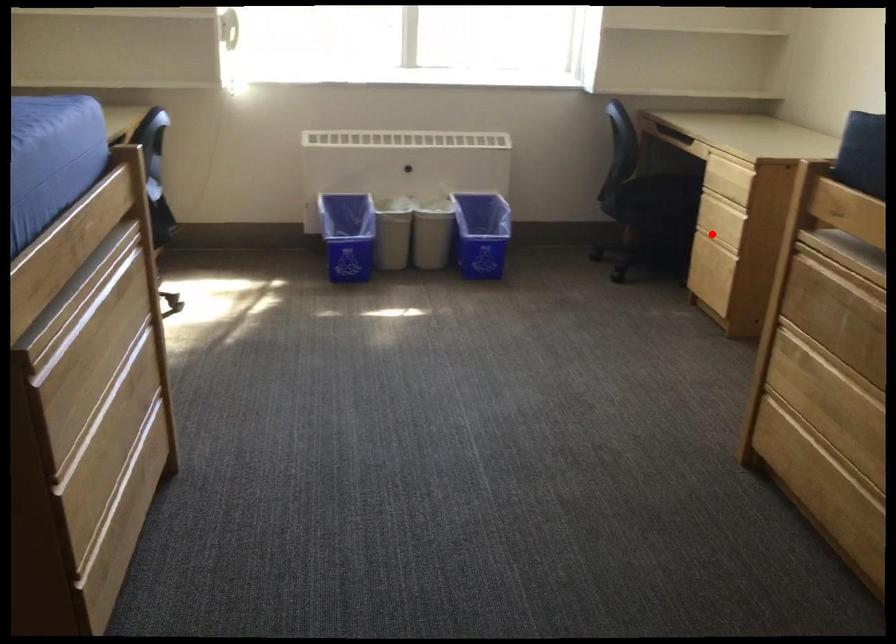
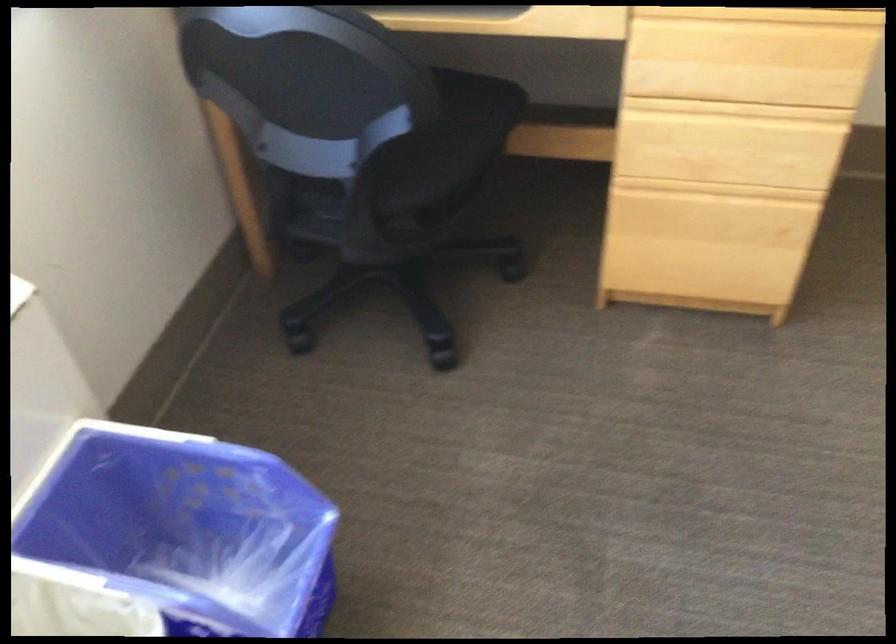
Find the pixel in the second image that matches the highlighted location in the first image.

(718, 190)